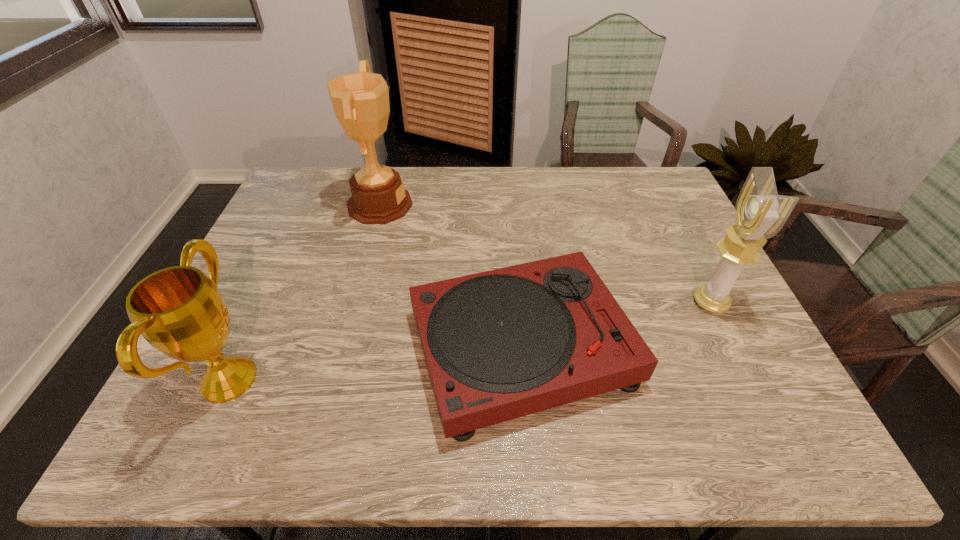
Locate an element on the screen. vacant space located on the front-facing side of the rightmost object is located at coordinates (658, 303).

Locate an element on the screen. The height and width of the screenshot is (540, 960). free space located 0.370m on the front-facing side of the rightmost object is located at coordinates (547, 303).

At what (x,y) coordinates should I click in order to perform the action: click on vacant space situated 0.260m on the front-facing side of the third tallest object. Please return your answer as a coordinate pair (x, y). This screenshot has height=540, width=960. Looking at the image, I should click on (381, 380).

Where is `free space located 0.160m on the right of the shortest object`? The image size is (960, 540). free space located 0.160m on the right of the shortest object is located at coordinates (705, 347).

At what (x,y) coordinates should I click in order to perform the action: click on object at the far edge. Please return your answer as a coordinate pair (x, y). The image size is (960, 540). Looking at the image, I should click on (x=360, y=100).

Locate an element on the screen. award at the near edge is located at coordinates (179, 311).

Image resolution: width=960 pixels, height=540 pixels. I want to click on record player located at the near edge, so tap(501, 344).

This screenshot has height=540, width=960. In order to click on object at the left edge in this screenshot , I will do `click(179, 311)`.

This screenshot has height=540, width=960. I want to click on object located in the right edge section of the desktop, so click(760, 213).

The height and width of the screenshot is (540, 960). In order to click on object that is at the near left corner in this screenshot , I will do `click(179, 311)`.